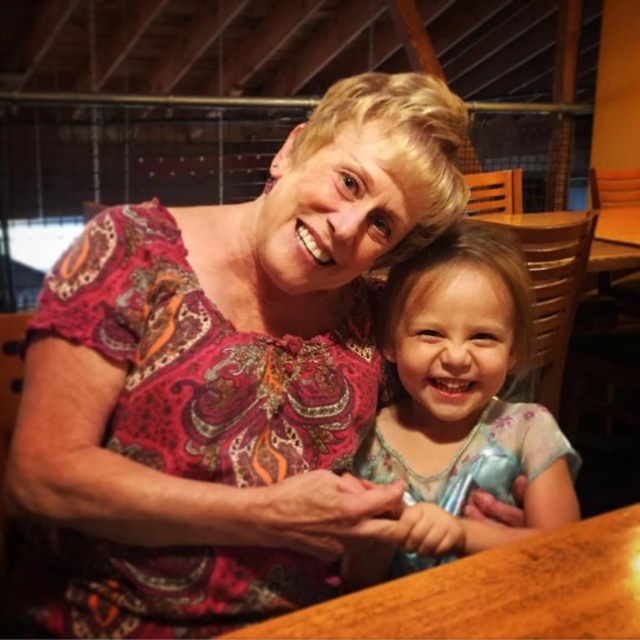
You are sitting at a wooden table in a cozy indoor setting. There are two points marked on the table. The first point is at coordinates point (189, 440) and the second is at point (333, 627). From your perspective, which point is closer to you?

Point (333, 627) is closer to you because it is in front of point (189, 440).

You are a photographer trying to capture a candid shot of the scene. The patterned fabric blouse at upper left and the wooden table at center are both in view. Which object is taller?

The patterned fabric blouse at upper left is taller than the wooden table at center according to the description.